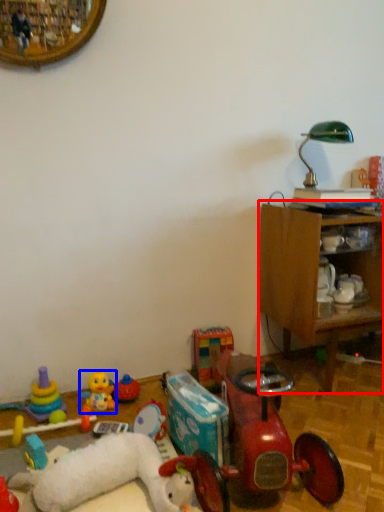
Question: Which object is further to the camera taking this photo, furniture (highlighted by a red box) or toy (highlighted by a blue box)?

Choices:
 (A) furniture
 (B) toy

Answer: (B)